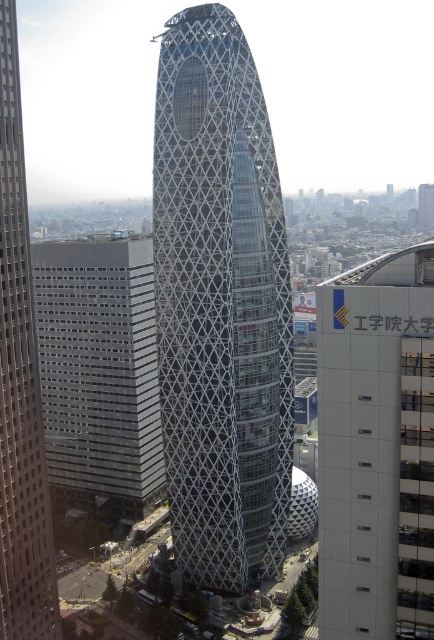
Does metallic lattice tower at center have a larger size compared to white concrete building at right?

Yes.

The width and height of the screenshot is (434, 640). What do you see at coordinates (220, 305) in the screenshot?
I see `metallic lattice tower at center` at bounding box center [220, 305].

Image resolution: width=434 pixels, height=640 pixels. I want to click on metallic lattice tower at center, so click(x=220, y=305).

Is gray glass building at left wider than gray glass skyscraper at center?

Yes, gray glass building at left is wider than gray glass skyscraper at center.

Which is in front, point (138, 468) or point (19, 304)?

Positioned in front is point (19, 304).

Image resolution: width=434 pixels, height=640 pixels. I want to click on gray glass building at left, so [x=98, y=374].

Can you confirm if metallic lattice tower at center is positioned below gray glass building at left?

Actually, metallic lattice tower at center is above gray glass building at left.

Who is shorter, metallic lattice tower at center or gray glass building at left?

gray glass building at left is shorter.

Between point (194, 544) and point (147, 488), which one is positioned in front?

Point (194, 544) is more forward.

Image resolution: width=434 pixels, height=640 pixels. What are the coordinates of `metallic lattice tower at center` in the screenshot? It's located at (220, 305).